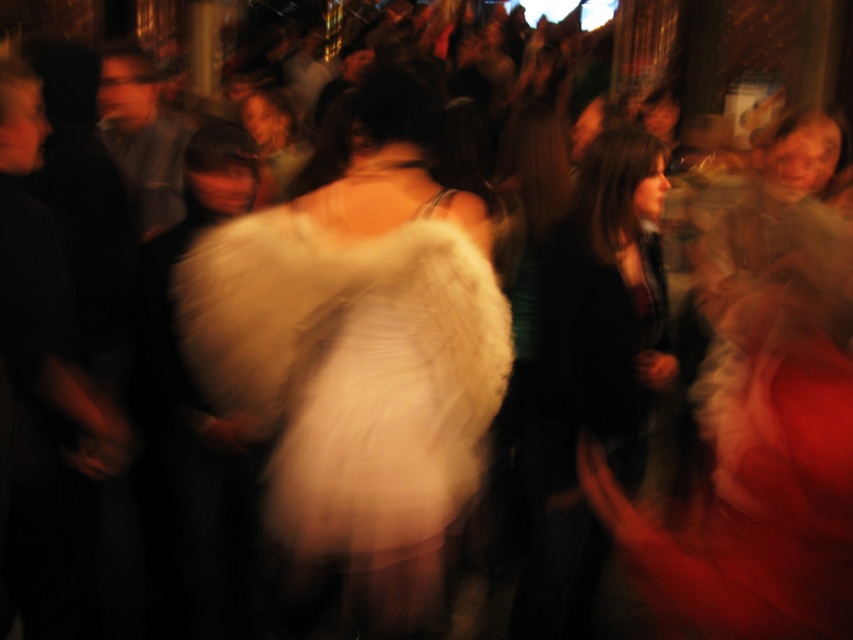
Question: Does white fluffy dress at center have a larger size compared to dark green fabric jacket at center?

Choices:
 (A) no
 (B) yes

Answer: (B)

Question: Which point is closer to the camera?

Choices:
 (A) dark green fabric jacket at center
 (B) white fluffy dress at center

Answer: (B)

Question: Is white fluffy dress at center thinner than dark green fabric jacket at center?

Choices:
 (A) yes
 (B) no

Answer: (B)

Question: Does white fluffy dress at center lie in front of dark green fabric jacket at center?

Choices:
 (A) no
 (B) yes

Answer: (B)